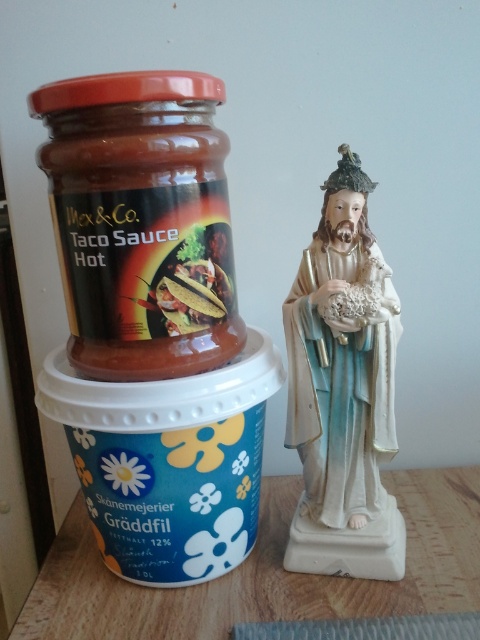
Does matte glass jar at left appear on the left side of red plastic lid at upper left?

Incorrect, matte glass jar at left is not on the left side of red plastic lid at upper left.

Which is above, matte glass jar at left or red plastic lid at upper left?

red plastic lid at upper left is above.

Image resolution: width=480 pixels, height=640 pixels. What are the coordinates of `matte glass jar at left` in the screenshot? It's located at (141, 221).

Can you confirm if wooden table at center is positioned to the left of red plastic lid at upper left?

Incorrect, wooden table at center is not on the left side of red plastic lid at upper left.

Is point (384, 476) positioned after point (176, 86)?

That is True.

The image size is (480, 640). Identify the location of wooden table at center. (265, 572).

Does matte glass jar at left have a lesser height compared to wooden table at center?

No.

Is matte glass jar at left bigger than wooden table at center?

Actually, matte glass jar at left might be smaller than wooden table at center.

Locate an element on the screen. The image size is (480, 640). matte glass jar at left is located at coordinates (141, 221).

The height and width of the screenshot is (640, 480). What are the coordinates of `matte glass jar at left` in the screenshot? It's located at (141, 221).